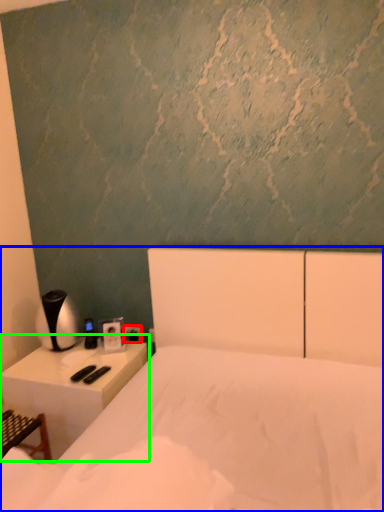
Question: Which object is positioned closest to electric outlet (highlighted by a red box)? Select from bed (highlighted by a blue box) and nightstand (highlighted by a green box).

Choices:
 (A) bed
 (B) nightstand

Answer: (B)